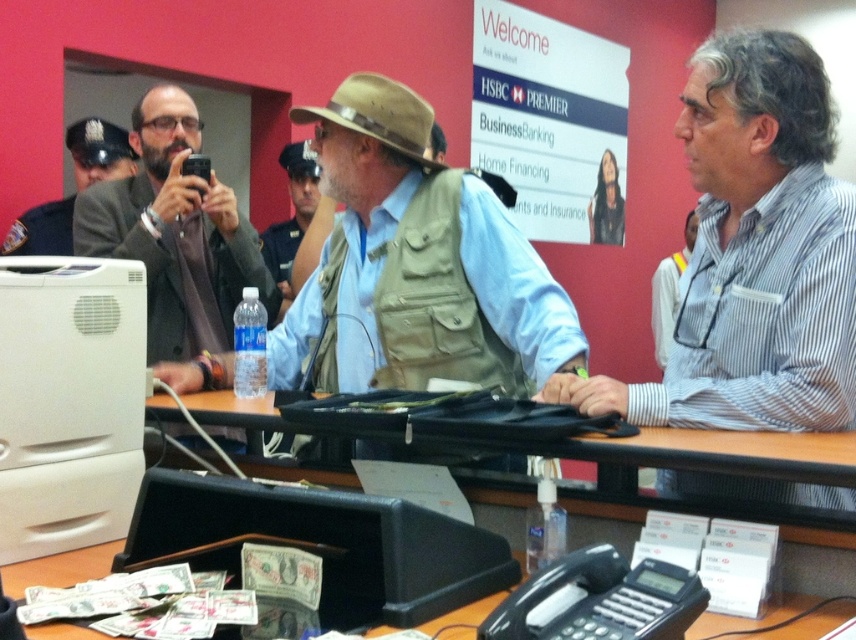
Question: Which point is farther to the camera?

Choices:
 (A) (794, 97)
 (B) (93, 118)

Answer: (B)

Question: Which point appears closest to the camera in this image?

Choices:
 (A) (809, 177)
 (B) (281, 305)

Answer: (A)

Question: Which of the following is the farthest from the observer?

Choices:
 (A) wooden table at center
 (B) dark gray uniform at left

Answer: (B)

Question: Is white striped shirt at center wider than brown leather jacket at center?

Choices:
 (A) yes
 (B) no

Answer: (B)

Question: Observing the image, what is the correct spatial positioning of brown leather jacket at center in reference to tan fabric vest at center?

Choices:
 (A) left
 (B) right

Answer: (A)

Question: Does khaki fabric vest at center appear over brown leather jacket at center?

Choices:
 (A) yes
 (B) no

Answer: (B)